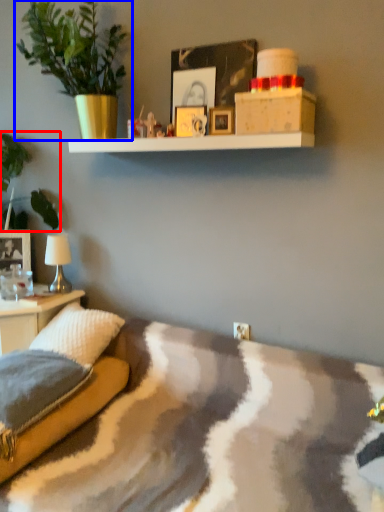
Question: Which point is closer to the camera, plant (highlighted by a red box) or houseplant (highlighted by a blue box)?

Choices:
 (A) plant
 (B) houseplant

Answer: (B)